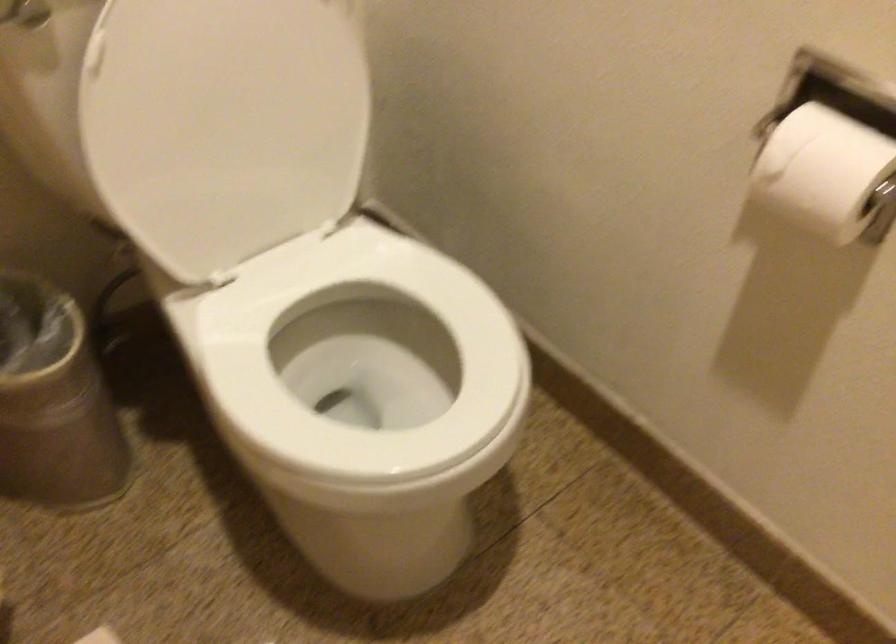
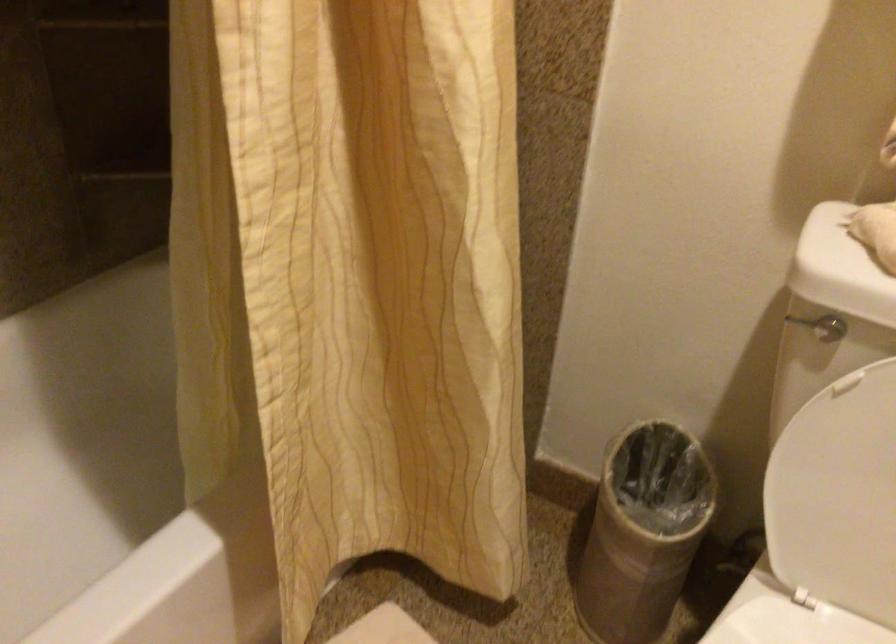
In the second image, find the point that corresponds to [166,161] in the first image.

(834, 480)